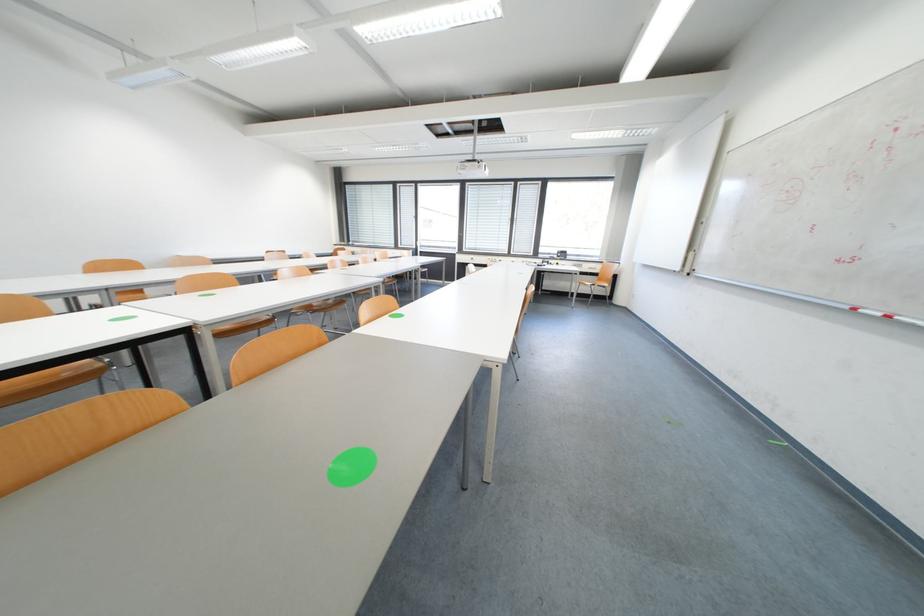
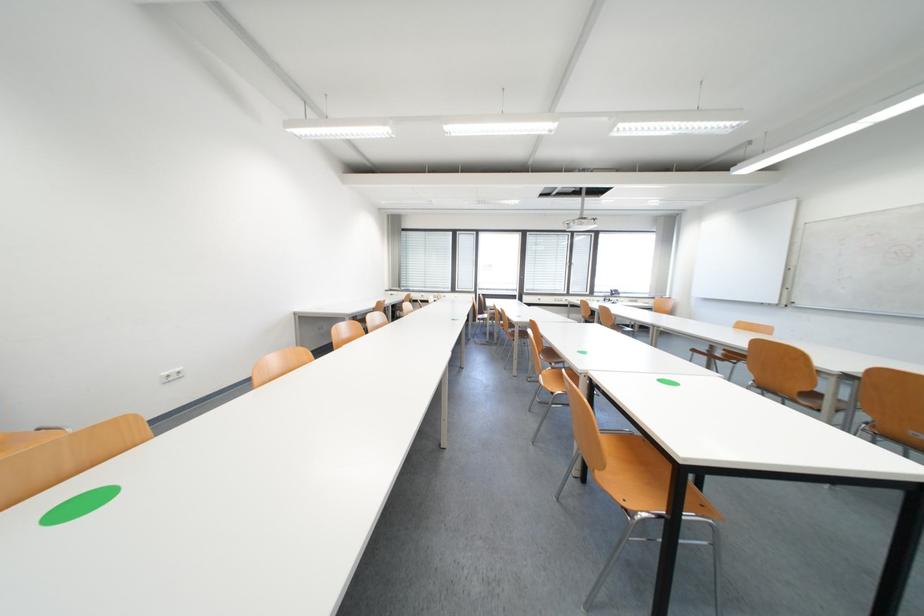
Question: The images are taken continuously from a first-person perspective. In which direction are you moving?

Choices:
 (A) Left
 (B) Right
 (C) Forward
 (D) Backward

Answer: (A)